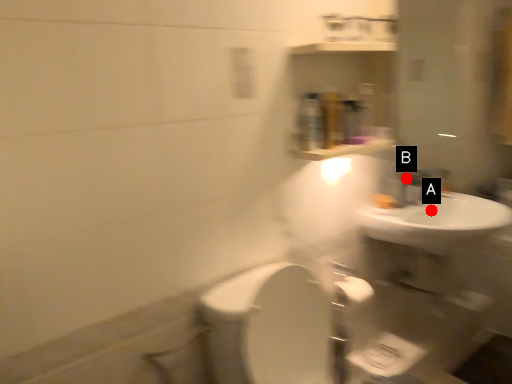
Question: Two points are circled on the image, labeled by A and B beside each circle. Among these points, which one is nearest to the camera?

Choices:
 (A) A is closer
 (B) B is closer

Answer: (A)